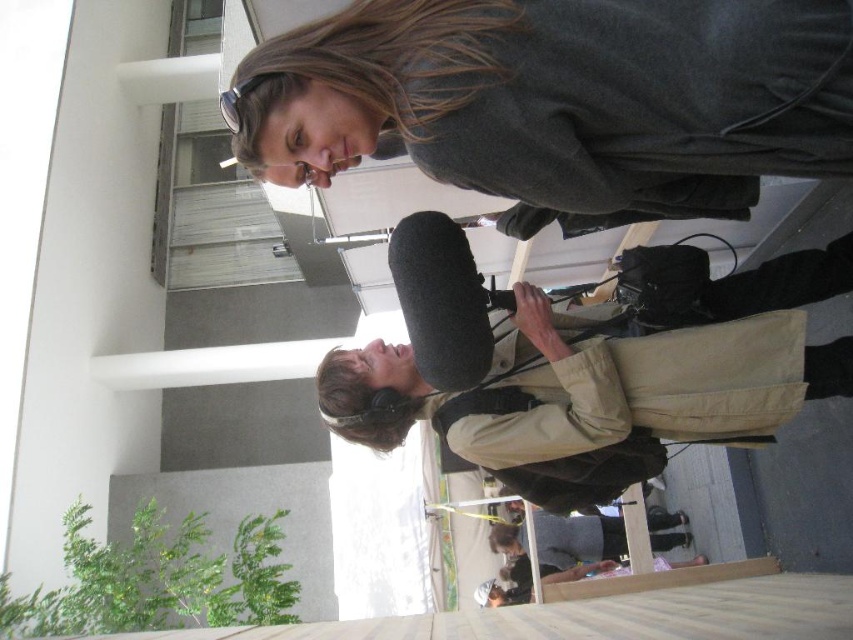
You are a photographer trying to capture a detailed shot of the dark gray sweater at upper center and the beige fabric backpack at center. Since you want to focus on both items, which one should you adjust your camera settings to prioritize in terms of focus and framing?

The dark gray sweater at upper center occupies less space than the beige fabric backpack at center, so you should prioritize focusing on the dark gray sweater at upper center to ensure its details are clear while framing the larger beige fabric backpack at center appropriately.

You are a photographer trying to capture both the dark gray sweater at upper center and the beige fabric backpack at center in the same frame. Given their distance apart, do you think you can fit both into your camera viewfinder without moving your position?

The dark gray sweater at upper center and beige fabric backpack at center are 20.27 inches apart. Since the distance between them is fixed, you can adjust your camera angle or zoom to include both objects within the frame without needing to move your position.